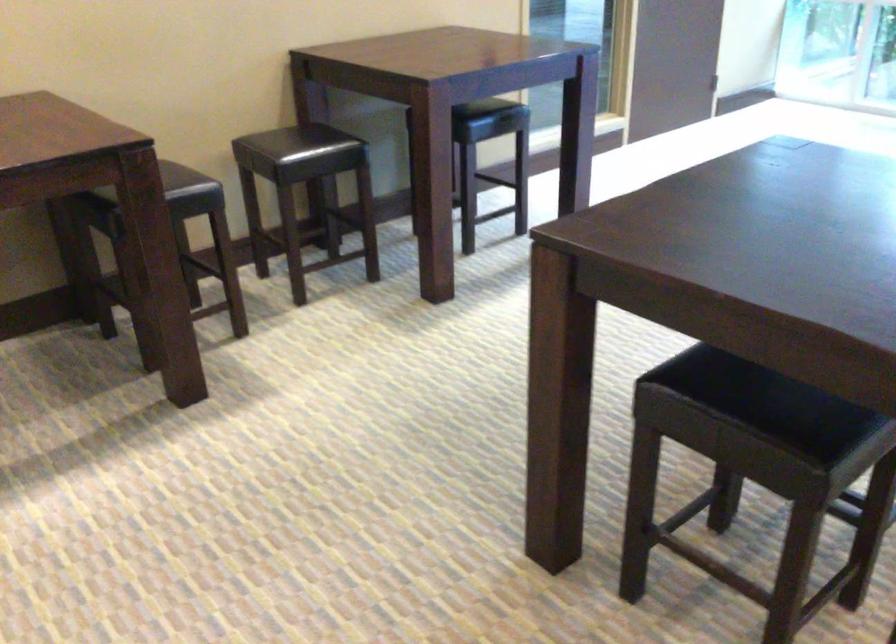
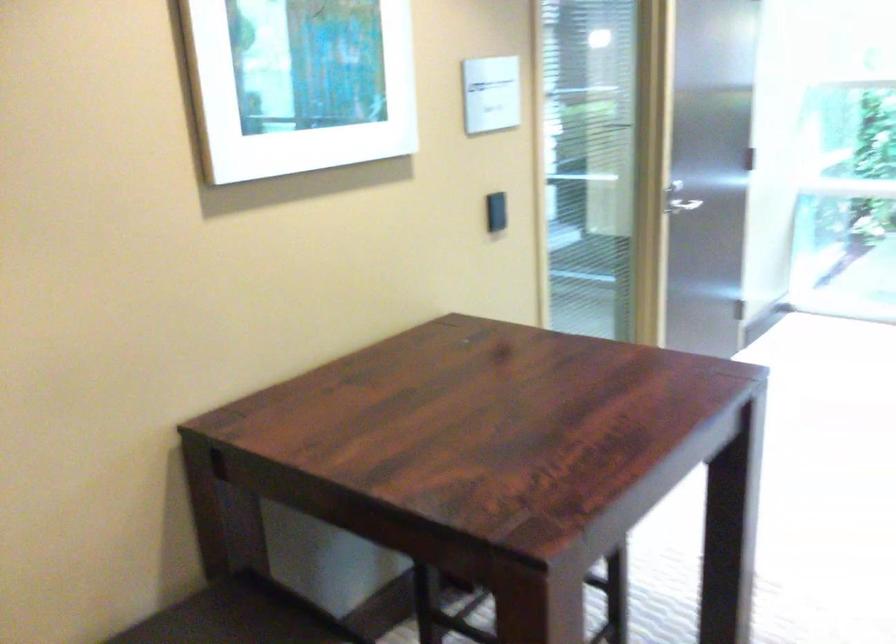
Question: In a continuous first-person perspective shot, in which direction is the camera moving?

Choices:
 (A) Left
 (B) Right
 (C) Forward
 (D) Backward

Answer: (C)